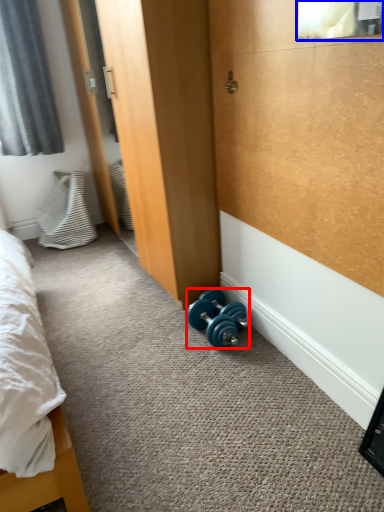
Question: Which of the following is the farthest to the observer, dumbbell (highlighted by a red box) or window screen (highlighted by a blue box)?

Choices:
 (A) dumbbell
 (B) window screen

Answer: (A)